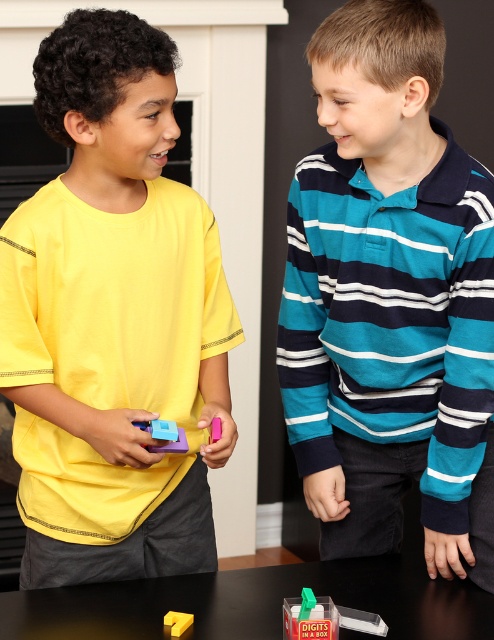
Question: From the image, what is the correct spatial relationship of matte yellow shirt at left in relation to matte plastic toy at center?

Choices:
 (A) right
 (B) left

Answer: (B)

Question: Which is farther from the translucent plastic container at center?

Choices:
 (A) yellow matte block at center
 (B) pink plastic smartphone at center
 (C) teal striped shirt at center

Answer: (C)

Question: Considering the real-world distances, which object is farthest from the yellow matte block at center?

Choices:
 (A) matte plastic toy at center
 (B) translucent plastic container at center
 (C) matte yellow shirt at left
 (D) teal striped shirt at center

Answer: (D)

Question: Does matte yellow shirt at left have a smaller size compared to translucent plastic container at center?

Choices:
 (A) no
 (B) yes

Answer: (A)

Question: Does matte yellow shirt at left appear under yellow matte block at center?

Choices:
 (A) no
 (B) yes

Answer: (A)

Question: Estimate the real-world distances between objects in this image. Which object is closer to the yellow matte block at center?

Choices:
 (A) matte yellow shirt at left
 (B) matte plastic toy at center
 (C) pink plastic smartphone at center
 (D) translucent plastic container at center

Answer: (D)